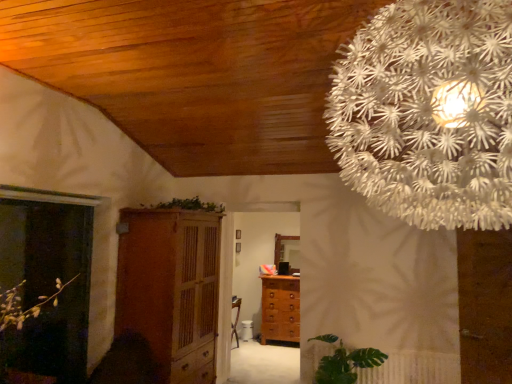
Question: Do you think white paper flower at upper right is within brown wooden chest of drawers at center, or outside of it?

Choices:
 (A) inside
 (B) outside

Answer: (B)

Question: Is point (456, 178) closer or farther from the camera than point (295, 317)?

Choices:
 (A) farther
 (B) closer

Answer: (B)

Question: Which of these objects is positioned farthest from the brown wooden chest of drawers at center?

Choices:
 (A) wooden cabinet at center
 (B) translucent glass screen door at left
 (C) green leafy plant at lower right
 (D) white paper flower at upper right
 (E) green leafy plant at upper center

Answer: (D)

Question: Considering the real-world distances, which object is closest to the brown wooden chest of drawers at center?

Choices:
 (A) green leafy plant at lower right
 (B) white paper flower at upper right
 (C) wooden cabinet at center
 (D) green leafy plant at upper center
 (E) translucent glass screen door at left

Answer: (A)